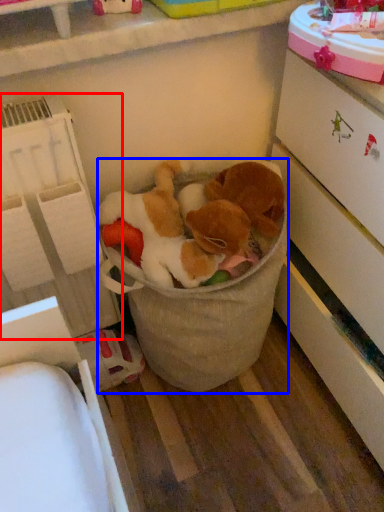
Question: Which of the following is the farthest to the observer, shelf (highlighted by a red box) or toy (highlighted by a blue box)?

Choices:
 (A) shelf
 (B) toy

Answer: (B)